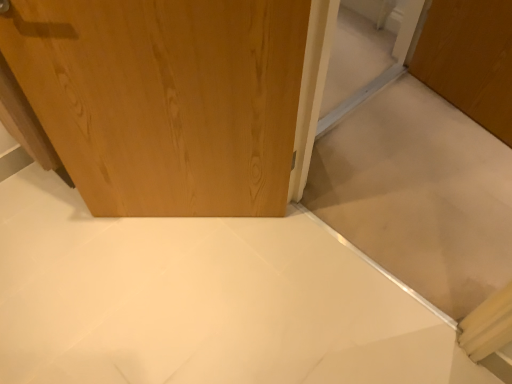
Describe the element at coordinates (165, 99) in the screenshot. The width and height of the screenshot is (512, 384). I see `wooden door at upper left` at that location.

Measure the distance between point (239, 23) and camera.

1.00 meters.

Find the location of a particular element. wooden door at upper left is located at coordinates (165, 99).

In order to face wooden door at center, should I rotate leftwards or rightwards?

You should look right and rotate roughly 18.754 degrees.

This screenshot has height=384, width=512. What do you see at coordinates (419, 194) in the screenshot?
I see `wooden door at center` at bounding box center [419, 194].

Locate an element on the screen. This screenshot has height=384, width=512. wooden door at center is located at coordinates (419, 194).

The width and height of the screenshot is (512, 384). Identify the location of wooden door at upper left. (165, 99).

Between wooden door at upper left and wooden door at center, which one appears on the right side from the viewer's perspective?

wooden door at center.

Relative to wooden door at center, is wooden door at upper left in front or behind?

wooden door at upper left is behind wooden door at center.

Is point (5, 52) closer to camera compared to point (456, 176)?

Yes, point (5, 52) is in front of point (456, 176).

From the image's perspective, which object appears higher, wooden door at upper left or wooden door at center?

wooden door at upper left.

Based on the photo, from a real-world perspective, between wooden door at upper left and wooden door at center, who is vertically lower?

In real-world perspective, wooden door at upper left is lower.

Between wooden door at upper left and wooden door at center, which one has smaller width?

With smaller width is wooden door at upper left.

Consider the image. Which of these two, wooden door at upper left or wooden door at center, stands taller?

wooden door at center is taller.

Considering the sizes of objects wooden door at upper left and wooden door at center in the image provided, who is bigger, wooden door at upper left or wooden door at center?

With larger size is wooden door at center.

Can we say wooden door at upper left lies outside wooden door at center?

wooden door at upper left lies outside wooden door at center's area.

Is wooden door at upper left positioned far away from wooden door at center?

wooden door at upper left is near wooden door at center, not far away.

Looking at this image, is wooden door at upper left positioned with its back to wooden door at center?

No, wooden door at upper left is not facing the opposite direction of wooden door at center.

Can you tell me how much wooden door at upper left and wooden door at center differ in facing direction?

The angular difference between wooden door at upper left and wooden door at center is 48.2 degrees.

I want to click on door located above the wooden door at center (from the image's perspective), so click(x=165, y=99).

Which object is positioned more to the right, wooden door at center or wooden door at upper left?

wooden door at center.

Does wooden door at center lie behind wooden door at upper left?

No, it is in front of wooden door at upper left.

From the picture: Which point is more distant from viewer, (x=433, y=147) or (x=67, y=39)?

The point (x=433, y=147) is more distant.

From the image's perspective, is wooden door at center above wooden door at upper left?

No.

From the picture: From a real-world perspective, between wooden door at center and wooden door at upper left, who is vertically higher?

In real-world perspective, wooden door at center is above.

Looking at their sizes, would you say wooden door at center is wider or thinner than wooden door at upper left?

wooden door at center is wider than wooden door at upper left.

Does wooden door at center have a greater height compared to wooden door at upper left?

Yes.

Is wooden door at center bigger than wooden door at upper left?

Yes.

Consider the image. Is wooden door at upper left inside wooden door at center?

Actually, wooden door at upper left is outside wooden door at center.

Is wooden door at center not close to wooden door at upper left?

No, wooden door at center is in close proximity to wooden door at upper left.

Looking at this image, is wooden door at center facing away from wooden door at upper left?

wooden door at center is not turned away from wooden door at upper left.

How distant is wooden door at center from wooden door at upper left?

The distance of wooden door at center from wooden door at upper left is 30.51 inches.

I want to click on cabinetry in front of the wooden door at upper left, so click(x=419, y=194).

The width and height of the screenshot is (512, 384). What are the coordinates of `cabinetry that is on the right side of wooden door at upper left` in the screenshot? It's located at (419, 194).

The height and width of the screenshot is (384, 512). I want to click on cabinetry that appears below the wooden door at upper left (from the image's perspective), so click(x=419, y=194).